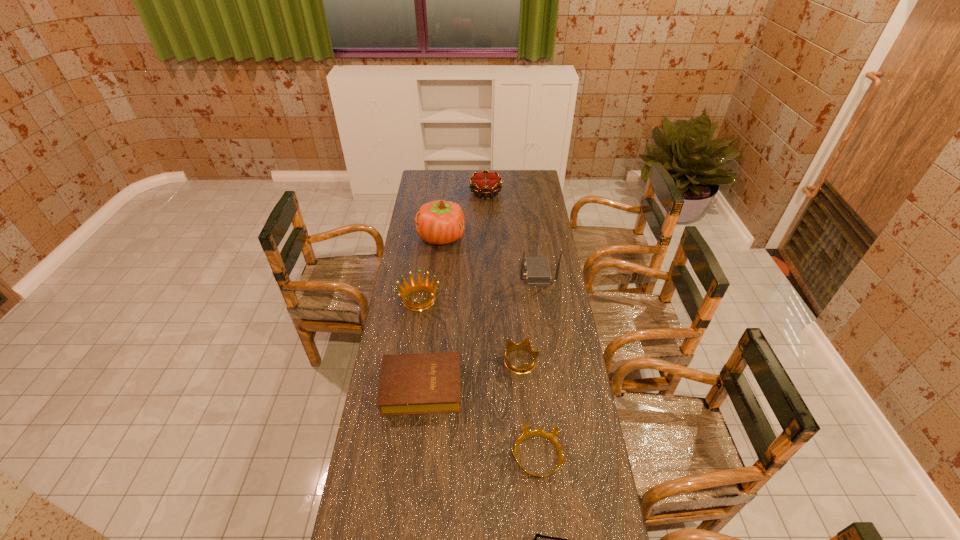
This screenshot has width=960, height=540. I want to click on blank space located 0.060m on the back of the router to connect cables, so click(x=507, y=273).

Where is `free space located 0.050m on the back of the router to connect cables`? free space located 0.050m on the back of the router to connect cables is located at coordinates (509, 273).

You are a GUI agent. You are given a task and a screenshot of the screen. Output one action in this format:
    pyautogui.click(x=<x>, y=<y>)
    Task: Click on the free space located 0.200m on the left of the farthest object
    
    Given the screenshot: What is the action you would take?
    pyautogui.click(x=436, y=193)

At what (x,y) coordinates should I click in order to perform the action: click on free region located 0.070m on the right of the leftmost crown. Please return your answer as a coordinate pair (x, y). The image size is (960, 540). Looking at the image, I should click on (456, 300).

Identify the location of vacant space located on the front of the third farthest crown. (531, 483).

At what (x,y) coordinates should I click in order to perform the action: click on vacant space positioned on the front of the Bible. Please return your answer as a coordinate pair (x, y). This screenshot has width=960, height=540. Looking at the image, I should click on pos(411,485).

At what (x,y) coordinates should I click in order to perform the action: click on free space located 0.260m on the back of the shortest crown. Please return your answer as a coordinate pair (x, y). This screenshot has width=960, height=540. Looking at the image, I should click on (529, 369).

You are a GUI agent. You are given a task and a screenshot of the screen. Output one action in this format:
    pyautogui.click(x=<x>, y=<y>)
    Task: Click on the object that is positioned at the far edge
    Image resolution: width=960 pixels, height=540 pixels.
    Given the screenshot: What is the action you would take?
    pyautogui.click(x=485, y=183)

Identify the location of pumpkin at the left edge. Image resolution: width=960 pixels, height=540 pixels. (439, 222).

The height and width of the screenshot is (540, 960). What are the coordinates of `crown that is at the left edge` in the screenshot? It's located at (420, 286).